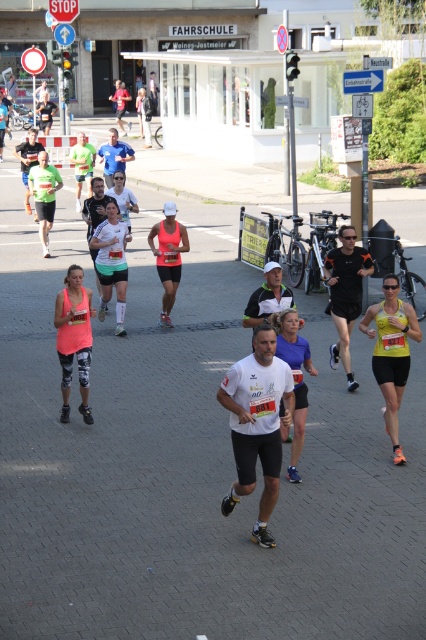
You are a photographer at the marathon and want to capture a photo of the runner wearing the matte black leggings at center and the pink matte tank top at center. Which clothing item is lower in the photo?

The matte black leggings at center is shorter than the pink matte tank top at center, so the matte black leggings at center will appear lower in the photo.

You are a photographer positioned at the origin point of the coordinate system. You want to capture a photo of the matte black leggings at center. What are the coordinates where you should aim your camera?

The coordinates to aim the camera are at point (x=74, y=339).